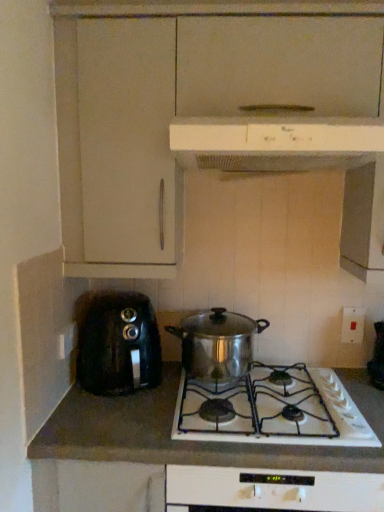
Locate an element on the screen. This screenshot has height=512, width=384. blank space above black plastic toaster at left (from a real-world perspective) is located at coordinates (119, 297).